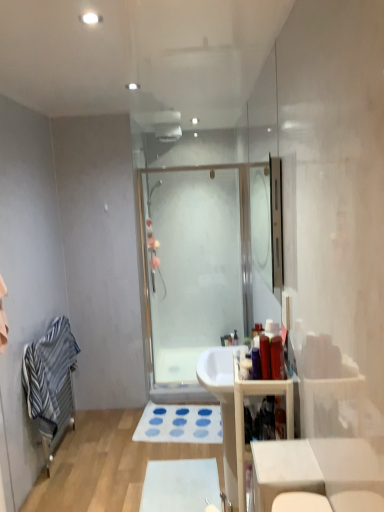
Question: From a real-world perspective, is white glossy table at lower right over matte plastic bottle at right, the 2th toiletry viewed from the right?

Choices:
 (A) no
 (B) yes

Answer: (A)

Question: From the image's perspective, is white glossy table at lower right on top of matte plastic bottle at right, placed as the second toiletry when sorted from left to right?

Choices:
 (A) no
 (B) yes

Answer: (A)

Question: Considering the relative sizes of white glossy table at lower right and matte plastic bottle at right, placed as the second toiletry when sorted from left to right, in the image provided, is white glossy table at lower right thinner than matte plastic bottle at right, placed as the second toiletry when sorted from left to right,?

Choices:
 (A) no
 (B) yes

Answer: (A)

Question: Considering the relative positions of white glossy table at lower right and matte plastic bottle at right, placed as the second toiletry when sorted from left to right, in the image provided, is white glossy table at lower right to the left of matte plastic bottle at right, placed as the second toiletry when sorted from left to right, from the viewer's perspective?

Choices:
 (A) yes
 (B) no

Answer: (B)

Question: Does white glossy table at lower right contain matte plastic bottle at right, the 2th toiletry viewed from the right?

Choices:
 (A) yes
 (B) no

Answer: (B)

Question: Can you confirm if white glossy table at lower right is bigger than matte plastic bottle at right, placed as the second toiletry when sorted from left to right?

Choices:
 (A) yes
 (B) no

Answer: (A)

Question: Is striped cotton bath towel at left not close to white matte bath mat at lower center, which appears as the 2th bath mat when viewed from the top?

Choices:
 (A) yes
 (B) no

Answer: (B)

Question: Considering the relative sizes of striped cotton bath towel at left and white matte bath mat at lower center, the second bath mat in the back-to-front sequence, in the image provided, is striped cotton bath towel at left thinner than white matte bath mat at lower center, the second bath mat in the back-to-front sequence,?

Choices:
 (A) no
 (B) yes

Answer: (B)

Question: Is striped cotton bath towel at left surrounding white matte bath mat at lower center, the second bath mat in the back-to-front sequence?

Choices:
 (A) yes
 (B) no

Answer: (B)

Question: From the image's perspective, would you say striped cotton bath towel at left is shown under white matte bath mat at lower center, the second bath mat in the back-to-front sequence?

Choices:
 (A) no
 (B) yes

Answer: (A)

Question: Is striped cotton bath towel at left touching white matte bath mat at lower center, the 1th bath mat when ordered from front to back?

Choices:
 (A) yes
 (B) no

Answer: (B)

Question: Can you confirm if striped cotton bath towel at left is wider than white matte bath mat at lower center, the first bath mat when ordered from bottom to top?

Choices:
 (A) no
 (B) yes

Answer: (A)

Question: From a real-world perspective, is wooden cabinet at right physically above clear glass mirror at upper center?

Choices:
 (A) no
 (B) yes

Answer: (A)